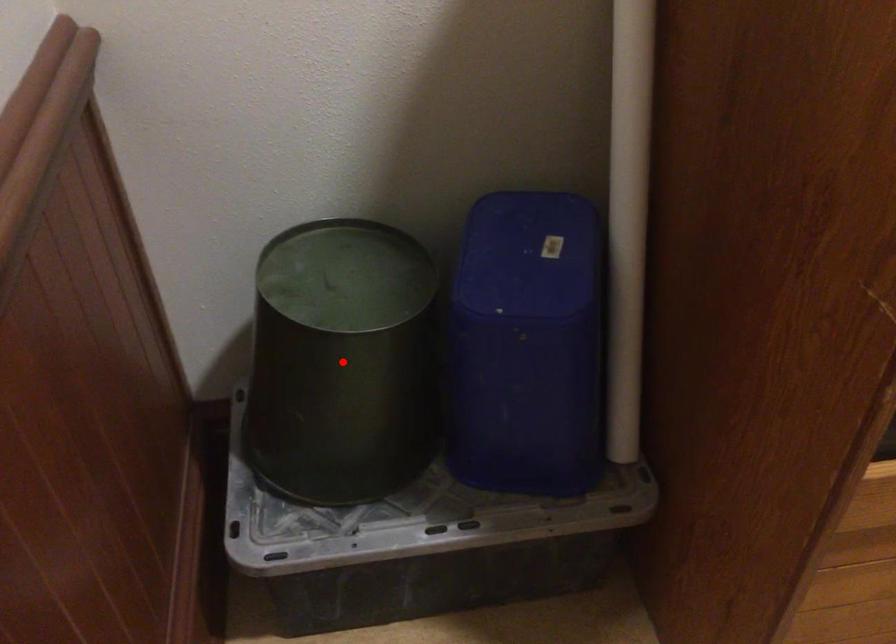
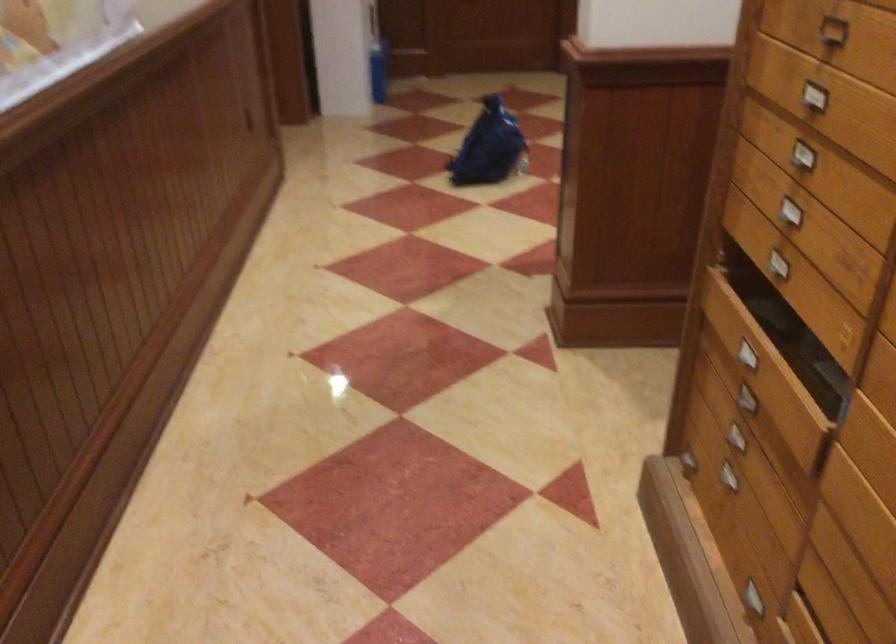
Question: I am providing you with two images of the same scene from different viewpoints. A red point is marked on the first image. Can you still see the location of the red point in image 2?

Choices:
 (A) Yes
 (B) No

Answer: (B)